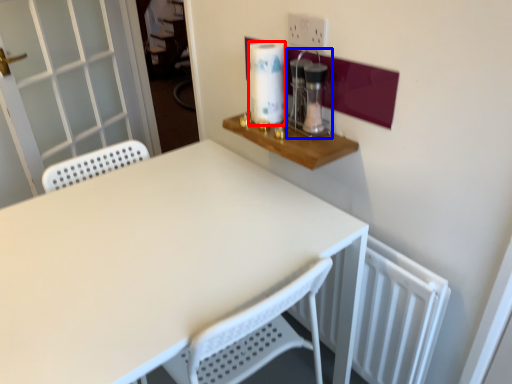
Question: Which object appears closest to the camera in this image, paper towel (highlighted by a red box) or coffee machine (highlighted by a blue box)?

Choices:
 (A) paper towel
 (B) coffee machine

Answer: (B)